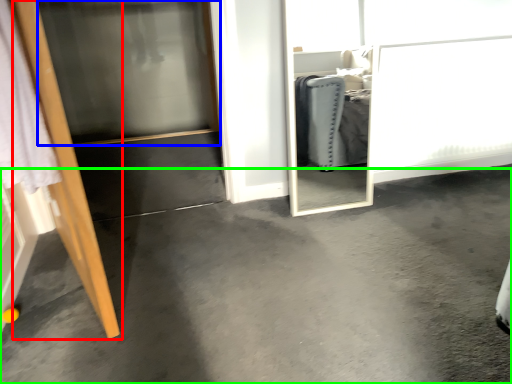
Question: Based on their relative distances, which object is nearer to door (highlighted by a red box)? Choose from screen door (highlighted by a blue box) and concrete (highlighted by a green box).

Choices:
 (A) screen door
 (B) concrete

Answer: (B)